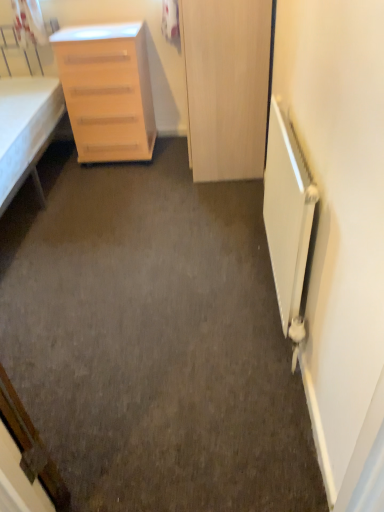
Locate an element on the screen. Image resolution: width=384 pixels, height=512 pixels. free area behind white matte radiator at right is located at coordinates (222, 236).